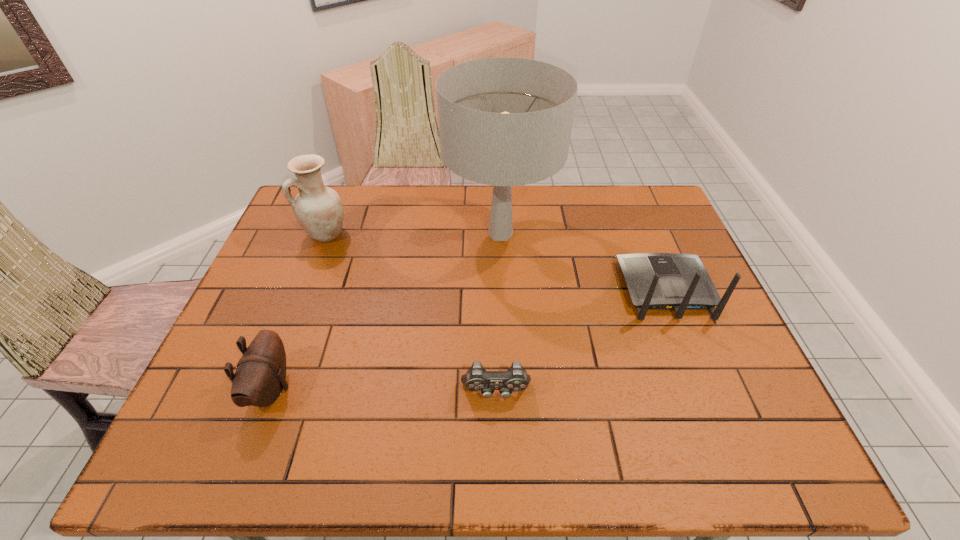
Find the location of a particular element. This screenshot has width=960, height=540. vacant position at the far edge of the desktop is located at coordinates (573, 202).

The width and height of the screenshot is (960, 540). Identify the location of vacant space at the near edge of the desktop. (614, 451).

Locate an element on the screen. vacant area at the right edge is located at coordinates (681, 367).

Locate an element on the screen. vacant space at the near left corner is located at coordinates (260, 430).

In the image, there is a desktop. In order to click on free region at the far right corner in this screenshot , I will do `click(616, 205)`.

The width and height of the screenshot is (960, 540). I want to click on vacant point located between the rightmost object and the lampshade, so click(x=583, y=262).

Where is `free spot between the control and the pottery`? The width and height of the screenshot is (960, 540). free spot between the control and the pottery is located at coordinates (411, 313).

Locate an element on the screen. The width and height of the screenshot is (960, 540). blank region between the tallest object and the rightmost object is located at coordinates (583, 262).

This screenshot has height=540, width=960. Find the location of `free space between the router and the lampshade`. free space between the router and the lampshade is located at coordinates (583, 262).

Where is `blank region between the second shortest object and the router`? Image resolution: width=960 pixels, height=540 pixels. blank region between the second shortest object and the router is located at coordinates (468, 339).